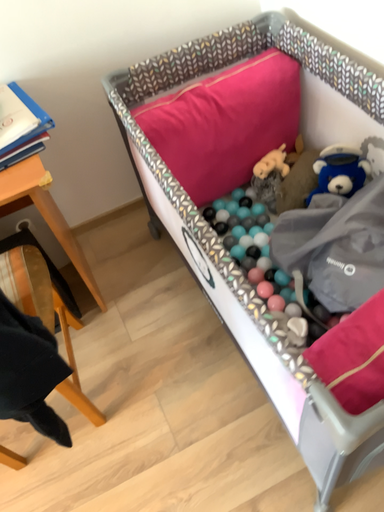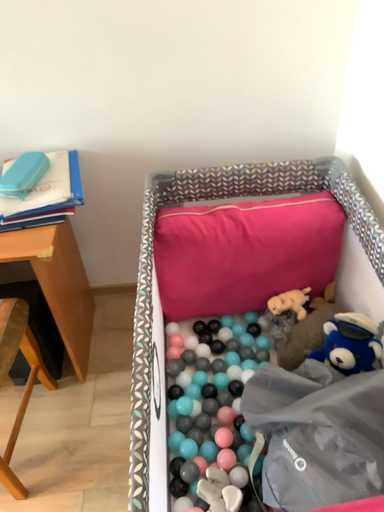
Question: How did the camera likely rotate when shooting the video?

Choices:
 (A) rotated upward
 (B) rotated downward

Answer: (A)